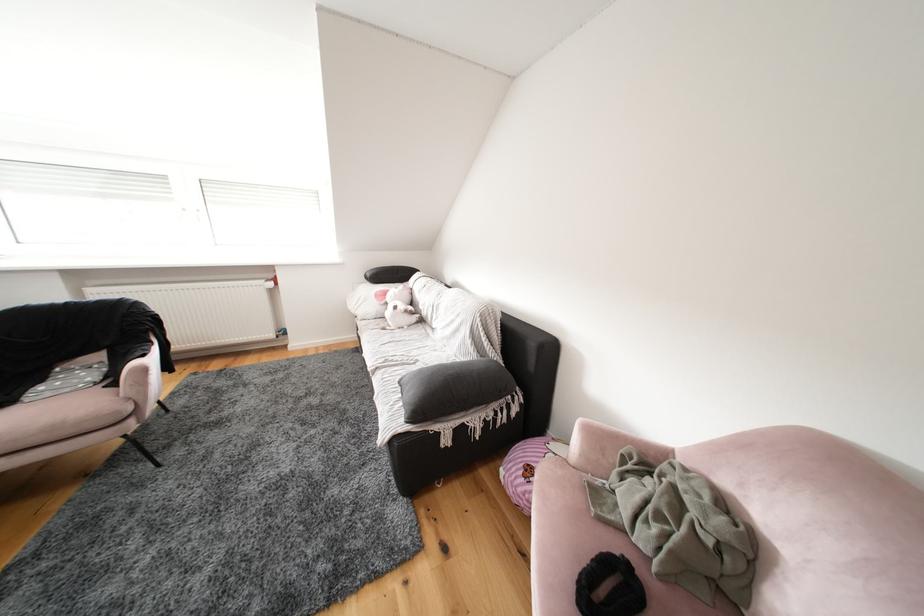
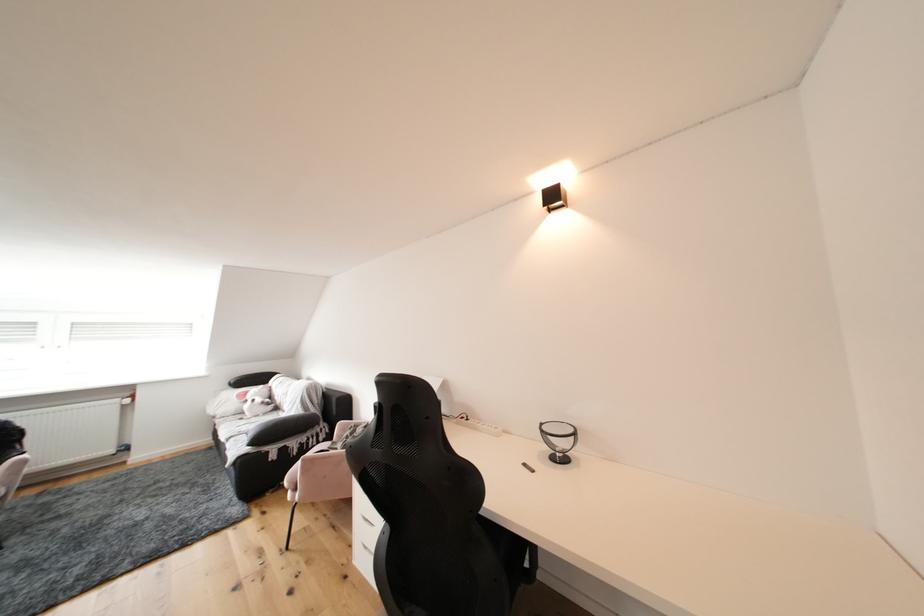
Question: I am providing you with two images of the same scene from different viewpoints. Please identify which objects are invisible in image2.

Choices:
 (A) white stuffed toy
 (B) black chair sitting surface
 (C) pink chair sitting surface
 (D) none of these

Answer: (D)